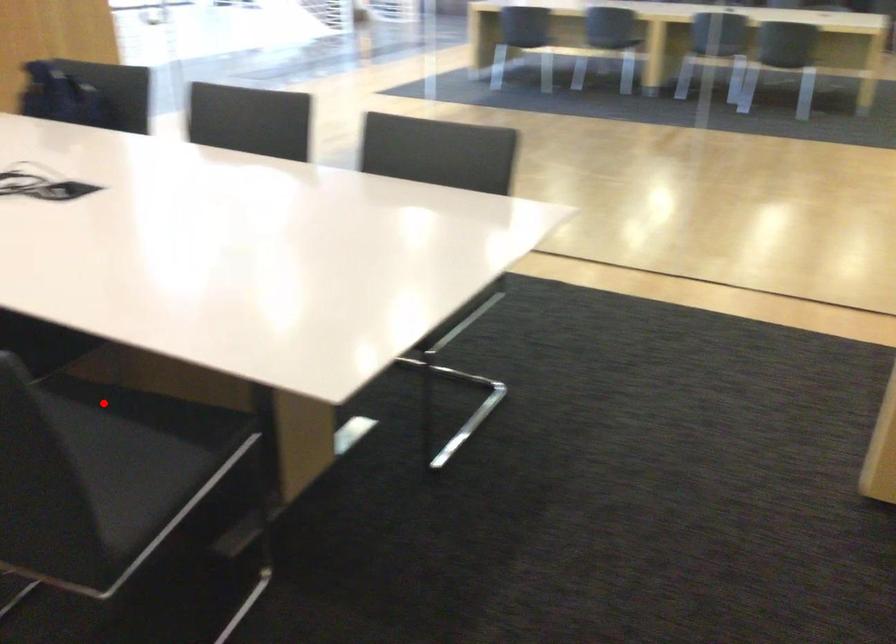
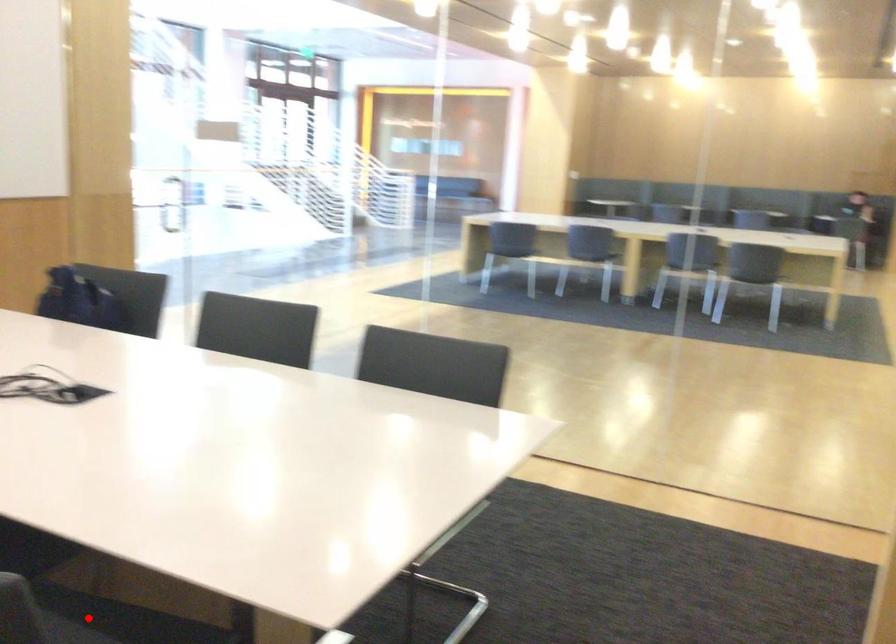
I am providing you with two images of the same scene from different viewpoints. A red point is marked on the first image and another point is marked on the second image. Is the marked point in image1 the same physical position as the marked point in image2?

Yes